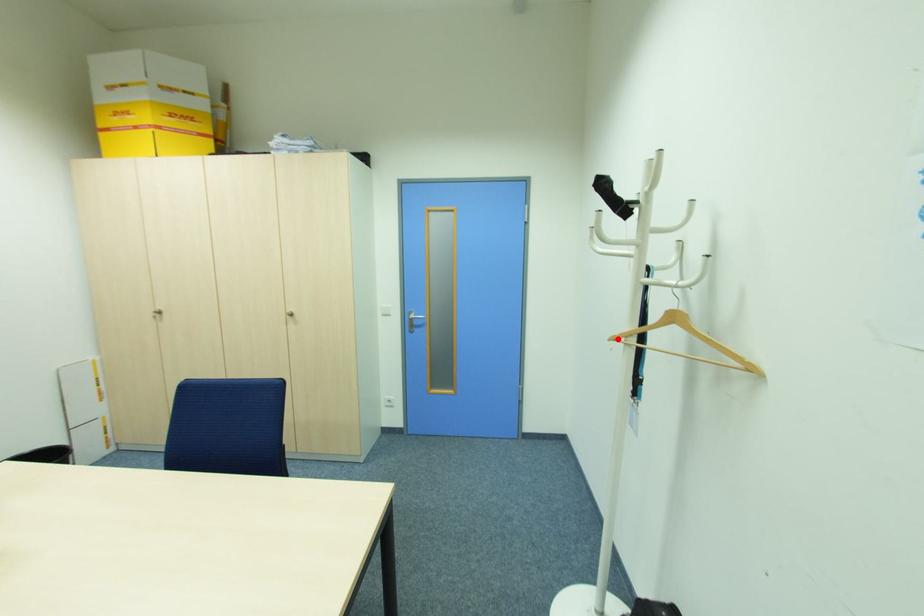
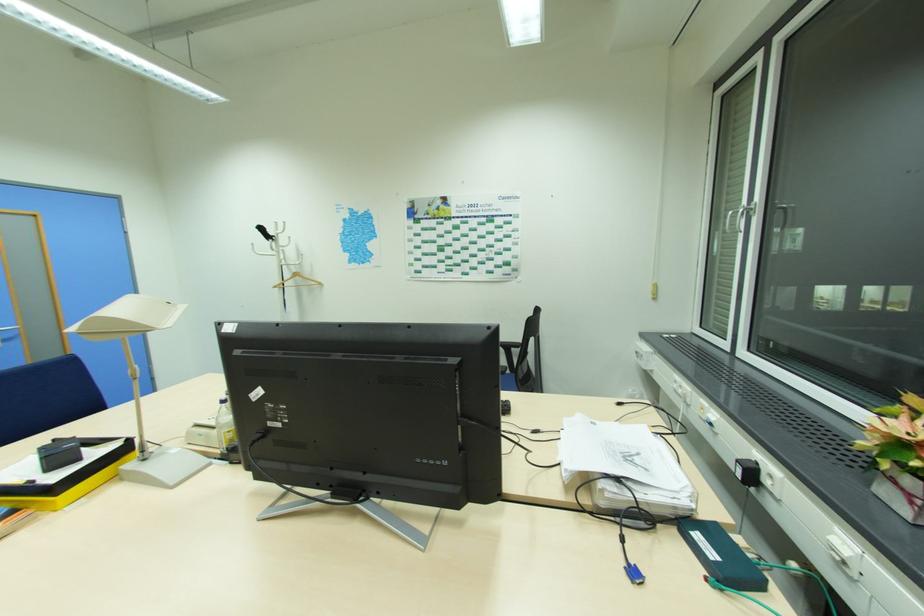
Where in the second image is the point corresponding to the highlighted location from the first image?

(277, 286)